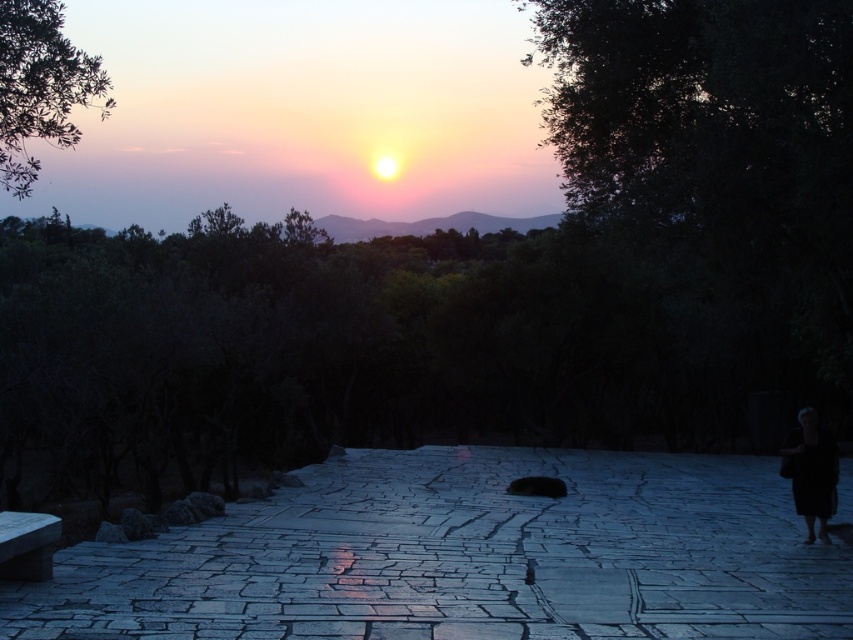
Question: Is gray stone path at center further to the viewer compared to black fabric bag at lower right?

Choices:
 (A) yes
 (B) no

Answer: (B)

Question: Does gray stone path at center appear on the left side of black fabric bag at lower right?

Choices:
 (A) yes
 (B) no

Answer: (A)

Question: Which point is farther to the camera?

Choices:
 (A) (811, 525)
 (B) (752, 493)

Answer: (B)

Question: Which of the following is the closest to the observer?

Choices:
 (A) black fabric bag at lower right
 (B) gray stone path at center

Answer: (B)

Question: Considering the relative positions of gray stone path at center and black fabric bag at lower right in the image provided, where is gray stone path at center located with respect to black fabric bag at lower right?

Choices:
 (A) left
 (B) right

Answer: (A)